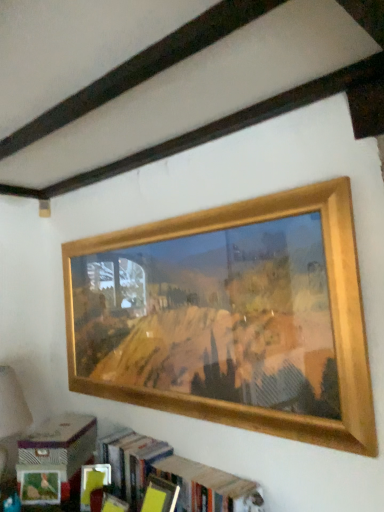
Question: Is point (92, 426) positioned closer to the camera than point (21, 467)?

Choices:
 (A) farther
 (B) closer

Answer: (A)

Question: Looking at the image, does matte cardboard box at lower left seem bigger or smaller compared to wooden bookshelf at lower center?

Choices:
 (A) big
 (B) small

Answer: (B)

Question: Considering the real-world distances, which object is closest to the matte cardboard box at lower left?

Choices:
 (A) wooden bookshelf at lower center
 (B) wooden picture frame at upper center

Answer: (A)

Question: Estimate the real-world distances between objects in this image. Which object is closer to the wooden picture frame at upper center?

Choices:
 (A) wooden bookshelf at lower center
 (B) matte cardboard box at lower left

Answer: (A)